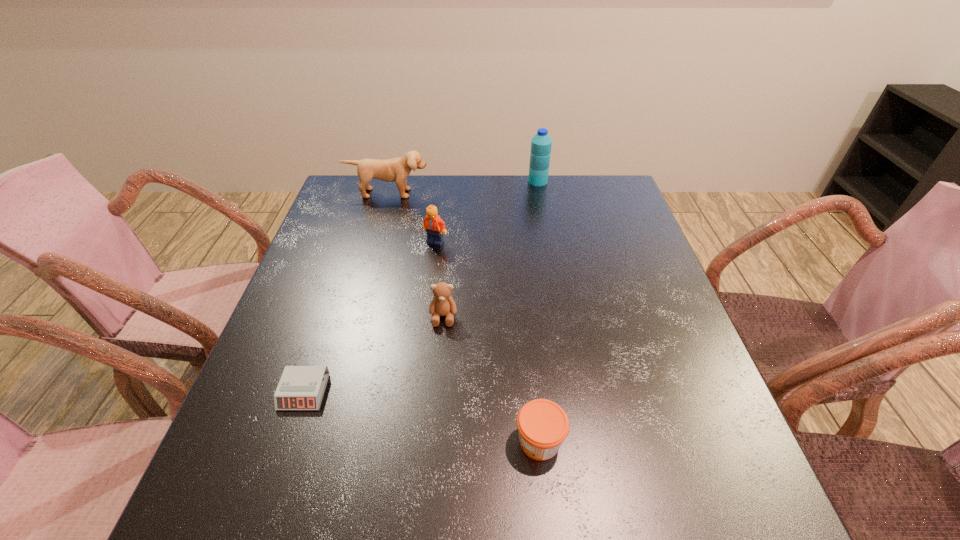
In the image, there is a desktop. Identify the location of vacant space at the near left corner. The image size is (960, 540). (247, 529).

Identify the location of vacant space at the far right corner of the desktop. This screenshot has height=540, width=960. pos(577,208).

Locate an element on the screen. Image resolution: width=960 pixels, height=540 pixels. vacant point located between the second farthest object and the fourth nearest object is located at coordinates (412, 218).

This screenshot has height=540, width=960. What are the coordinates of `vacant space that is in between the jam and the farthest object` in the screenshot? It's located at (539, 311).

Where is `free space between the farthest object and the fourth tallest object`? This screenshot has height=540, width=960. free space between the farthest object and the fourth tallest object is located at coordinates (491, 249).

The image size is (960, 540). Find the location of `unoccupied position between the puppy and the alarm clock`. unoccupied position between the puppy and the alarm clock is located at coordinates (346, 293).

Find the location of a particular element. The height and width of the screenshot is (540, 960). vacant space that's between the alarm clock and the third shortest object is located at coordinates (373, 354).

You are a GUI agent. You are given a task and a screenshot of the screen. Output one action in this format:
    pyautogui.click(x=<x>, y=<y>)
    Task: Click on the vacant space in between the fifth nearest object and the third shortest object
    
    Given the screenshot: What is the action you would take?
    pyautogui.click(x=416, y=255)

Where is `vacant space that's between the third nearest object and the shortest object`? vacant space that's between the third nearest object and the shortest object is located at coordinates (373, 354).

You are a GUI agent. You are given a task and a screenshot of the screen. Output one action in this format:
    pyautogui.click(x=<x>, y=<y>)
    Task: Click on the free space between the jam and the third nearest object
    The height and width of the screenshot is (540, 960).
    Given the screenshot: What is the action you would take?
    pyautogui.click(x=492, y=379)